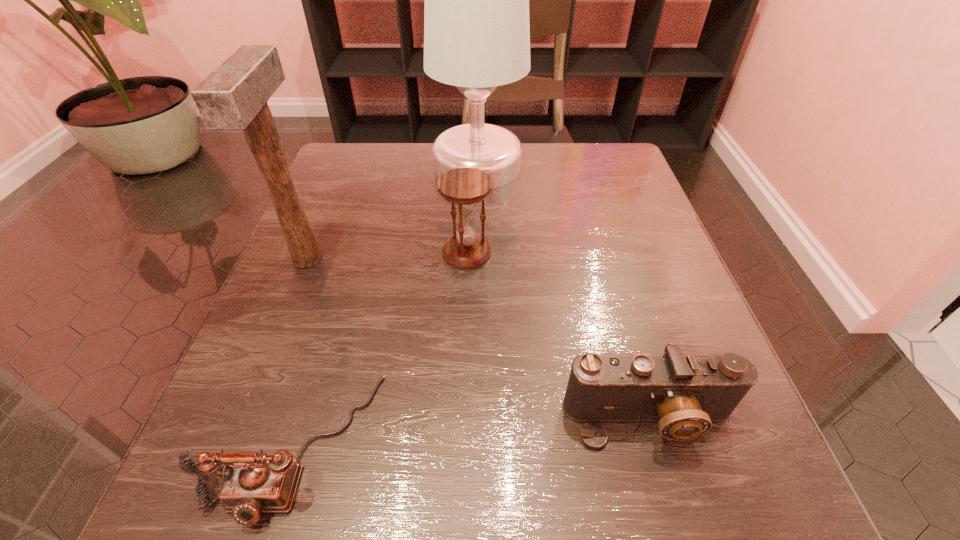
Identify the location of free space at the far left corner. (371, 142).

In the image, there is a desktop. Where is `free space at the far right corner`? Image resolution: width=960 pixels, height=540 pixels. free space at the far right corner is located at coordinates (584, 176).

What are the coordinates of `vacant space that is in between the telephone and the camera` in the screenshot? It's located at (472, 431).

Find the location of `free space between the shortest object and the fourth tallest object`. free space between the shortest object and the fourth tallest object is located at coordinates (472, 431).

In order to click on unoccupied position between the rightmost object and the hourglass in this screenshot , I will do `click(558, 335)`.

Identify the location of free spot between the telephone and the fourth shortest object. (301, 352).

The width and height of the screenshot is (960, 540). In order to click on vacant region between the second shortest object and the lampshade in this screenshot , I will do `click(563, 292)`.

Locate an element on the screen. vacant space that's between the tallest object and the camera is located at coordinates (563, 292).

The height and width of the screenshot is (540, 960). Find the location of `free space between the shortest object and the fourth tallest object`. free space between the shortest object and the fourth tallest object is located at coordinates (472, 431).

Locate an element on the screen. This screenshot has width=960, height=540. free space between the mallet and the third tallest object is located at coordinates (387, 256).